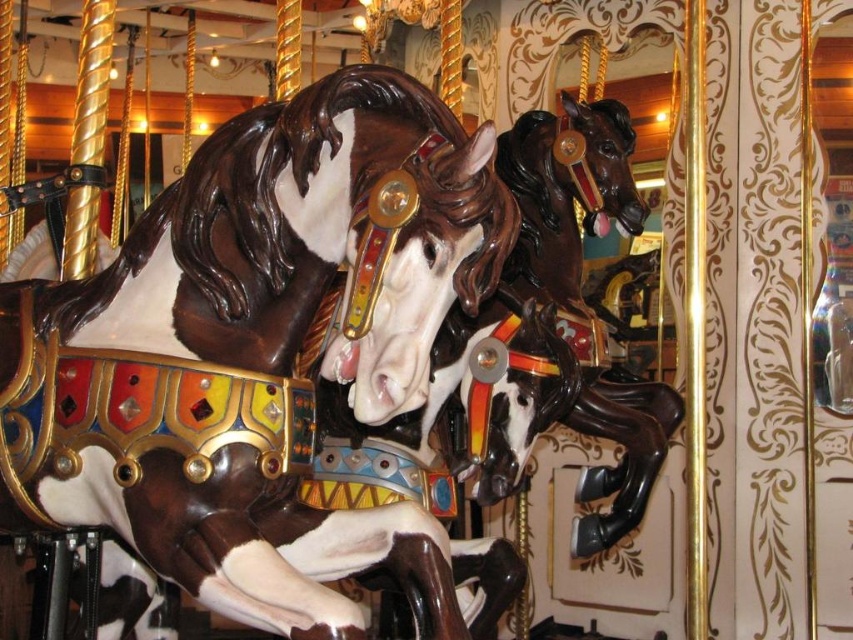
Question: Is shiny brown horse at center below shiny dark brown horse at center?

Choices:
 (A) no
 (B) yes

Answer: (B)

Question: Which point is closer to the camera?

Choices:
 (A) shiny brown horse at center
 (B) shiny dark brown horse at center

Answer: (A)

Question: Which point is farther to the camera?

Choices:
 (A) (352, 250)
 (B) (577, 305)

Answer: (B)

Question: Does shiny brown horse at center appear under shiny dark brown horse at center?

Choices:
 (A) yes
 (B) no

Answer: (A)

Question: Does shiny brown horse at center have a greater width compared to shiny dark brown horse at center?

Choices:
 (A) yes
 (B) no

Answer: (A)